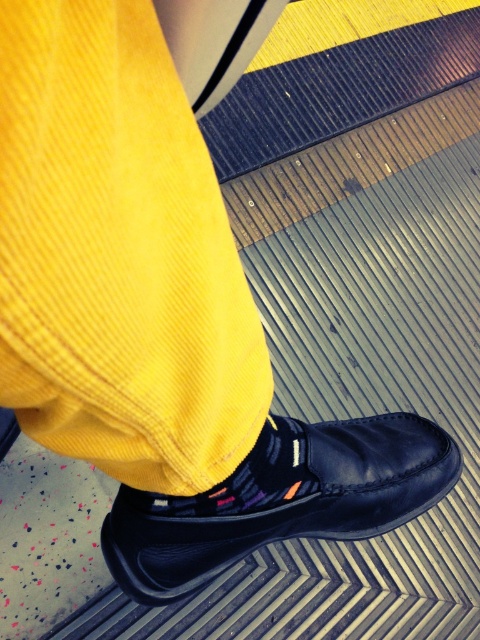
Question: Can you confirm if black leather shoe at lower center is positioned to the right of multicolored knit sock at center?

Choices:
 (A) yes
 (B) no

Answer: (A)

Question: Is black leather shoe at lower center positioned before multicolored knit sock at center?

Choices:
 (A) no
 (B) yes

Answer: (A)

Question: From the image, what is the correct spatial relationship of black leather shoe at lower center in relation to multicolored knit sock at center?

Choices:
 (A) below
 (B) above

Answer: (A)